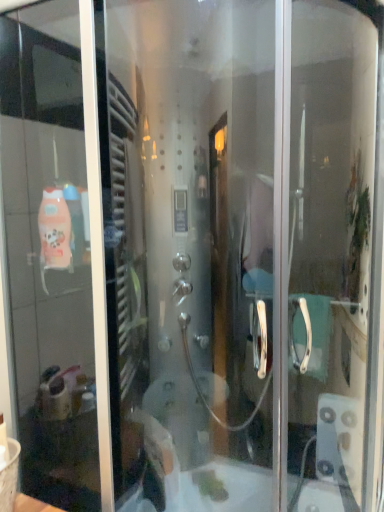
Where is `white glossy bathtub at center`? white glossy bathtub at center is located at coordinates (222, 489).

The image size is (384, 512). What do you see at coordinates (222, 489) in the screenshot?
I see `white glossy bathtub at center` at bounding box center [222, 489].

The height and width of the screenshot is (512, 384). I want to click on white glossy bathtub at center, so click(x=222, y=489).